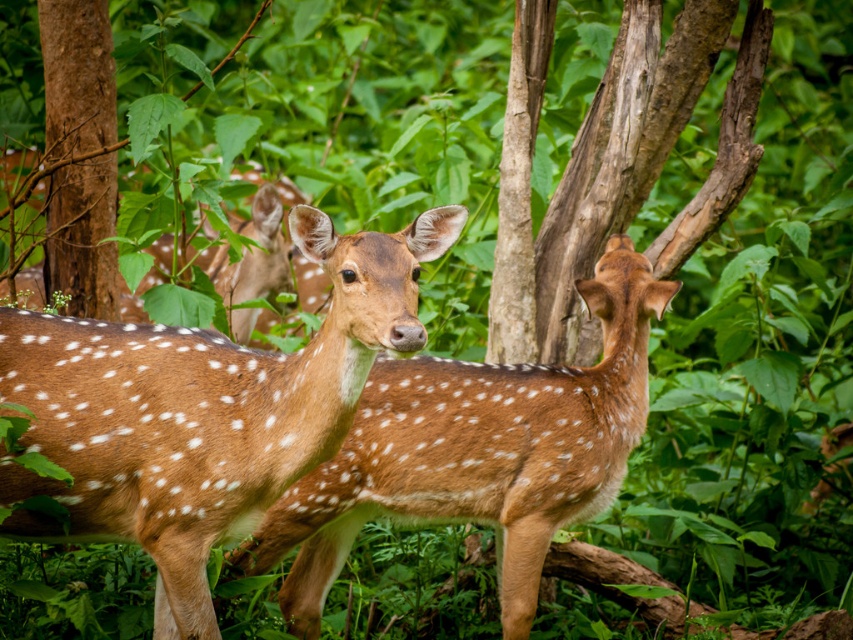
Which is below, brown spotted fur at center or brown rough tree trunk at left?

brown spotted fur at center is below.

Is brown spotted fur at center taller than brown rough tree trunk at left?

Incorrect, brown spotted fur at center's height is not larger of brown rough tree trunk at left's.

Is point (200, 390) in front of point (80, 38)?

Yes, it is.

The image size is (853, 640). Identify the location of brown spotted fur at center. (202, 410).

Who is lower down, brown speckled fur at center or brown rough tree trunk at left?

Positioned lower is brown speckled fur at center.

Can you confirm if brown speckled fur at center is positioned below brown rough tree trunk at left?

Indeed, brown speckled fur at center is positioned under brown rough tree trunk at left.

Identify the location of brown speckled fur at center. (476, 451).

Between brown spotted fur at center and brown speckled fur at center, which one is positioned lower?

brown speckled fur at center

Who is taller, brown spotted fur at center or brown speckled fur at center?

Standing taller between the two is brown speckled fur at center.

I want to click on brown spotted fur at center, so click(x=202, y=410).

The width and height of the screenshot is (853, 640). What are the coordinates of `brown spotted fur at center` in the screenshot? It's located at (202, 410).